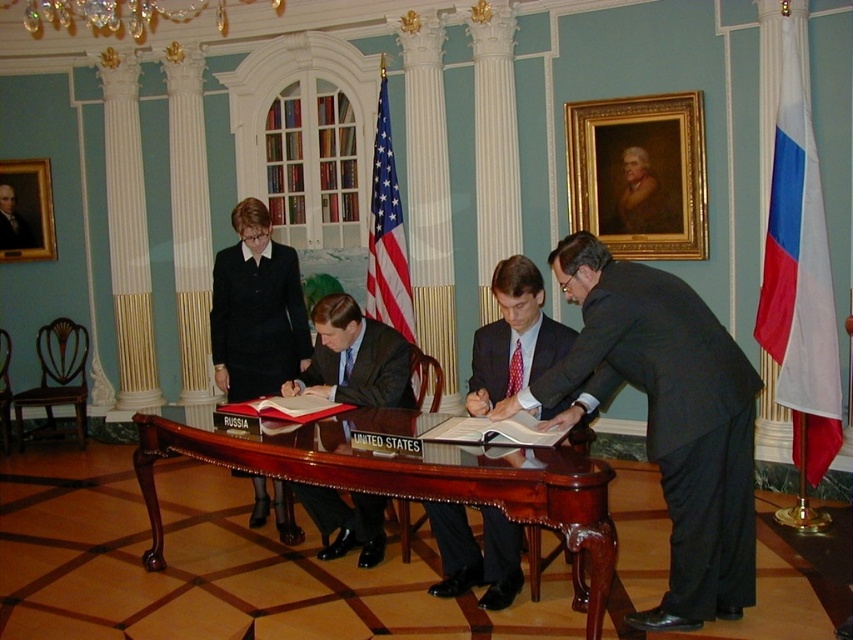
Question: Which is nearer to the smooth black suit at center?

Choices:
 (A) matte black suit at center
 (B) mahogany wood table at center
 (C) american flag at center

Answer: (C)

Question: Can you confirm if mahogany wood table at center is positioned to the right of matte black suit at center?

Choices:
 (A) yes
 (B) no

Answer: (B)

Question: Which point is farther from the camera taking this photo?

Choices:
 (A) (276, 376)
 (B) (526, 474)
 (C) (646, 228)

Answer: (C)

Question: Among these objects, which one is farthest from the camera?

Choices:
 (A) matte black suit at center
 (B) mahogany wood table at center
 (C) dark gray suit at center
 (D) white fabric flag at right

Answer: (D)

Question: Where is black matte suit at center located in relation to dark blue suit at center in the image?

Choices:
 (A) left
 (B) right

Answer: (A)

Question: Is mahogany wood table at center positioned behind matte black suit at center?

Choices:
 (A) no
 (B) yes

Answer: (A)